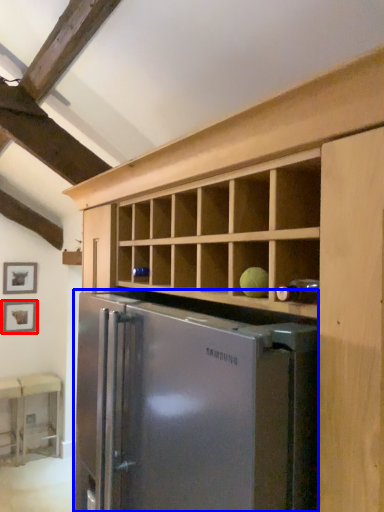
Question: Which of the following is the farthest to the observer, picture frame (highlighted by a red box) or refrigerator (highlighted by a blue box)?

Choices:
 (A) picture frame
 (B) refrigerator

Answer: (A)